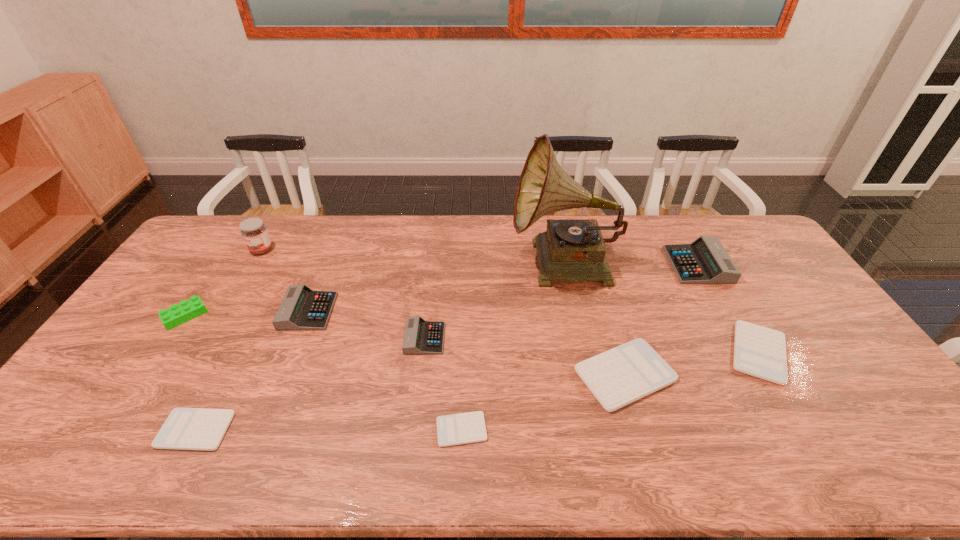
Image resolution: width=960 pixels, height=540 pixels. In order to click on the smallest gray calculator in this screenshot , I will do `click(421, 337)`.

This screenshot has width=960, height=540. I want to click on the fifth calculator from left to right, so click(631, 371).

Identify the location of the second white calculator from right to left. The width and height of the screenshot is (960, 540). (631, 371).

Locate an element on the screen. the third shortest calculator is located at coordinates pyautogui.click(x=758, y=351).

Find the location of `the third smallest white calculator`. the third smallest white calculator is located at coordinates (758, 351).

Locate an element on the screen. Image resolution: width=960 pixels, height=540 pixels. the third biggest white calculator is located at coordinates (185, 428).

The width and height of the screenshot is (960, 540). I want to click on the leftmost calculator, so click(x=185, y=428).

This screenshot has height=540, width=960. What are the coordinates of `the second white calculator from left to right` in the screenshot? It's located at (463, 428).

At what (x,y) coordinates should I click in order to perform the action: click on the shortest calculator. Please return your answer as a coordinate pair (x, y). The height and width of the screenshot is (540, 960). Looking at the image, I should click on (463, 428).

What are the coordinates of `vacant space located from the horn of the tallest object` in the screenshot? It's located at (447, 266).